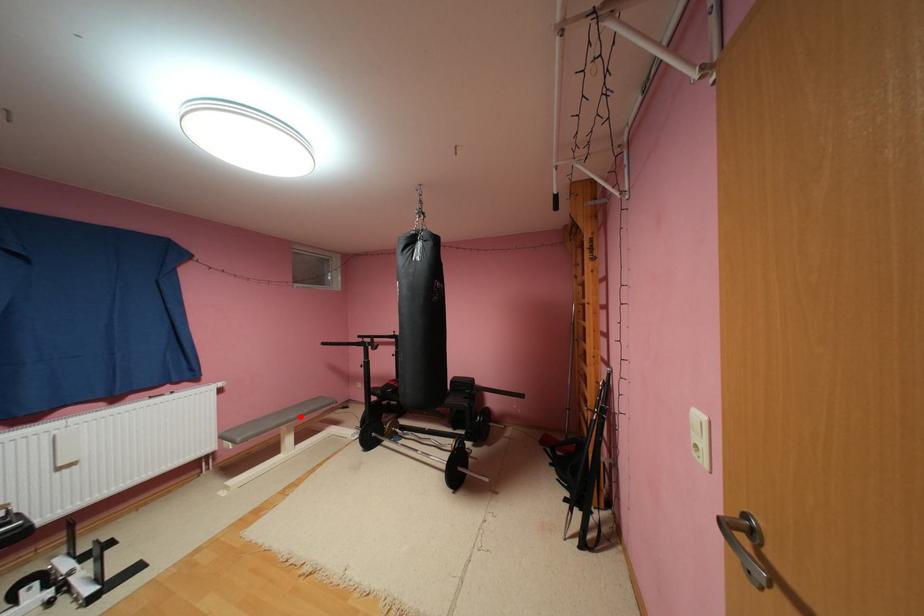
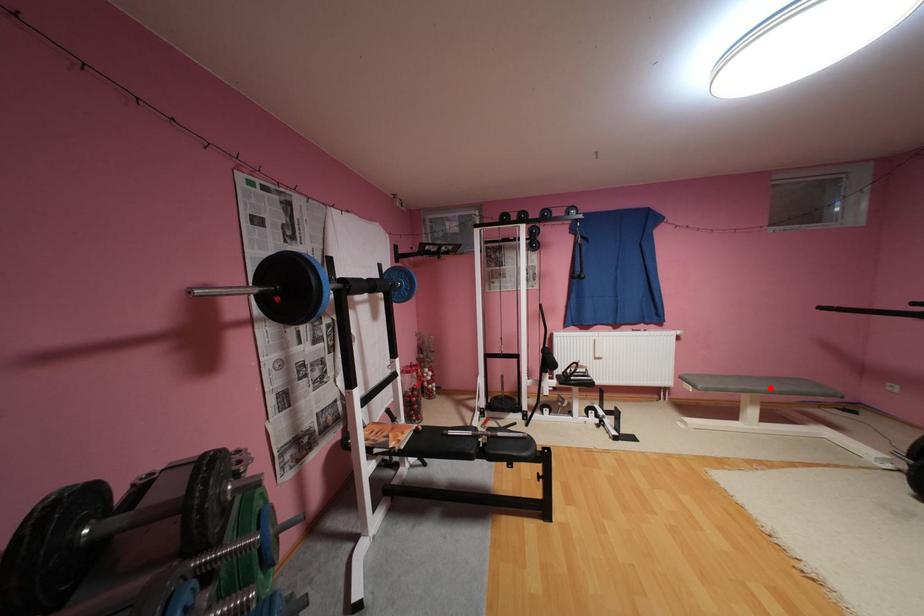
I am providing you with two images of the same scene from different viewpoints. A red point is marked on the first image and another point is marked on the second image. Do the highlighted points in image1 and image2 indicate the same real-world spot?

Yes